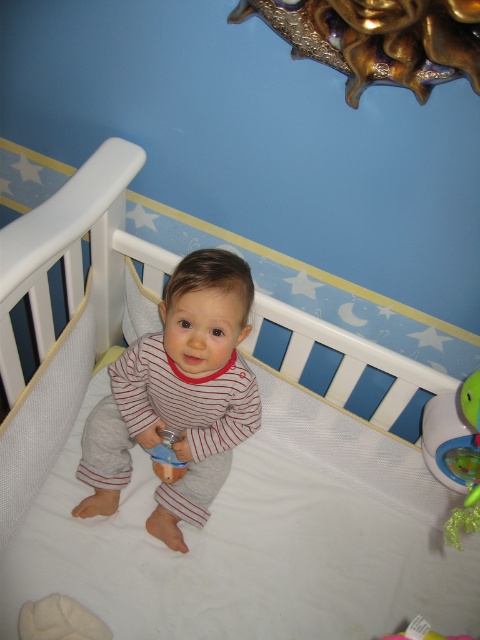
Question: Is striped cotton baby at center in front of blue rubber toy at center?

Choices:
 (A) yes
 (B) no

Answer: (A)

Question: Which point is closer to the camera?

Choices:
 (A) blue rubber toy at center
 (B) striped cotton baby at center

Answer: (B)

Question: Does striped cotton baby at center lie behind blue rubber toy at center?

Choices:
 (A) yes
 (B) no

Answer: (B)

Question: Does striped cotton baby at center appear on the left side of blue rubber toy at center?

Choices:
 (A) yes
 (B) no

Answer: (B)

Question: Which object is farther from the camera taking this photo?

Choices:
 (A) blue rubber toy at center
 (B) striped cotton baby at center

Answer: (A)

Question: Among these points, which one is farthest from the camera?

Choices:
 (A) (156, 449)
 (B) (239, 440)

Answer: (A)